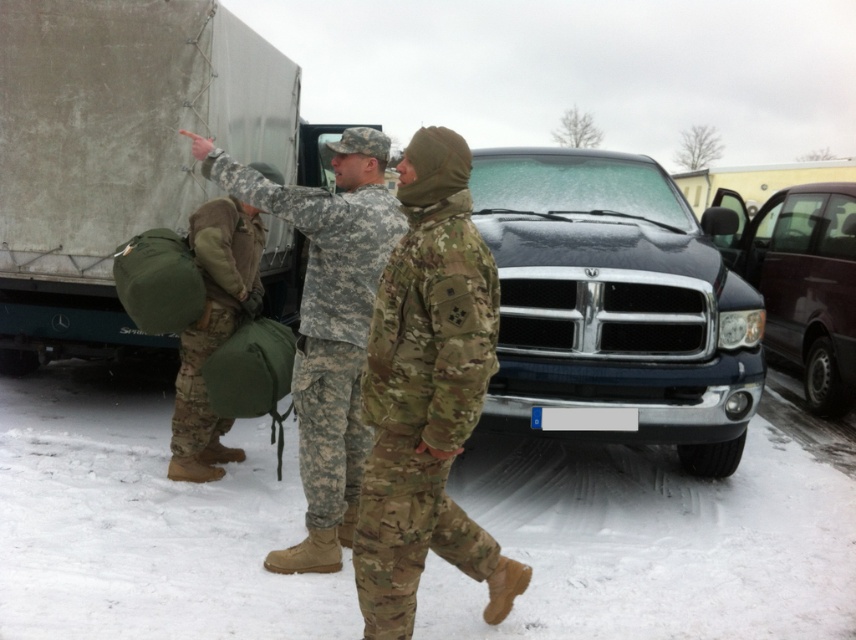
Can you confirm if camouflage fabric uniform at center is positioned to the left of camouflage uniform at center?

In fact, camouflage fabric uniform at center is to the right of camouflage uniform at center.

Does camouflage fabric uniform at center have a larger size compared to camouflage uniform at center?

No.

What do you see at coordinates (428, 394) in the screenshot? I see `camouflage fabric uniform at center` at bounding box center [428, 394].

The image size is (856, 640). Identify the location of camouflage fabric uniform at center. (428, 394).

Is white powdery snow at lower center thinner than gray matte truck at upper left?

No.

Can you confirm if white powdery snow at lower center is taller than gray matte truck at upper left?

In fact, white powdery snow at lower center may be shorter than gray matte truck at upper left.

This screenshot has height=640, width=856. In order to click on white powdery snow at lower center in this screenshot , I will do `click(652, 541)`.

At what (x,y) coordinates should I click in order to perform the action: click on white powdery snow at lower center. Please return your answer as a coordinate pair (x, y). Looking at the image, I should click on (652, 541).

Who is taller, camouflage uniform at center or camouflage fabric backpack at left?

camouflage uniform at center

Can you confirm if camouflage uniform at center is positioned above camouflage fabric backpack at left?

No.

What do you see at coordinates (325, 323) in the screenshot? The image size is (856, 640). I see `camouflage uniform at center` at bounding box center [325, 323].

This screenshot has width=856, height=640. I want to click on camouflage uniform at center, so click(325, 323).